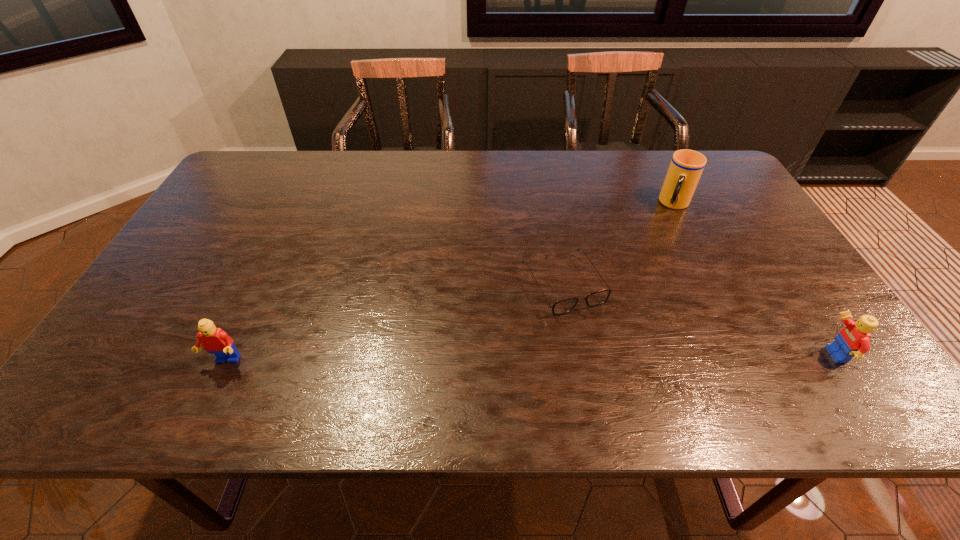
I want to click on free space on the desktop that is between the left Lego and the right Lego and is positioned on the front-facing side of the shortest object, so click(x=608, y=357).

Image resolution: width=960 pixels, height=540 pixels. I want to click on vacant space on the desktop that is between the leftmost object and the right Lego and is positioned on the side of the farthest object with the handle, so click(613, 357).